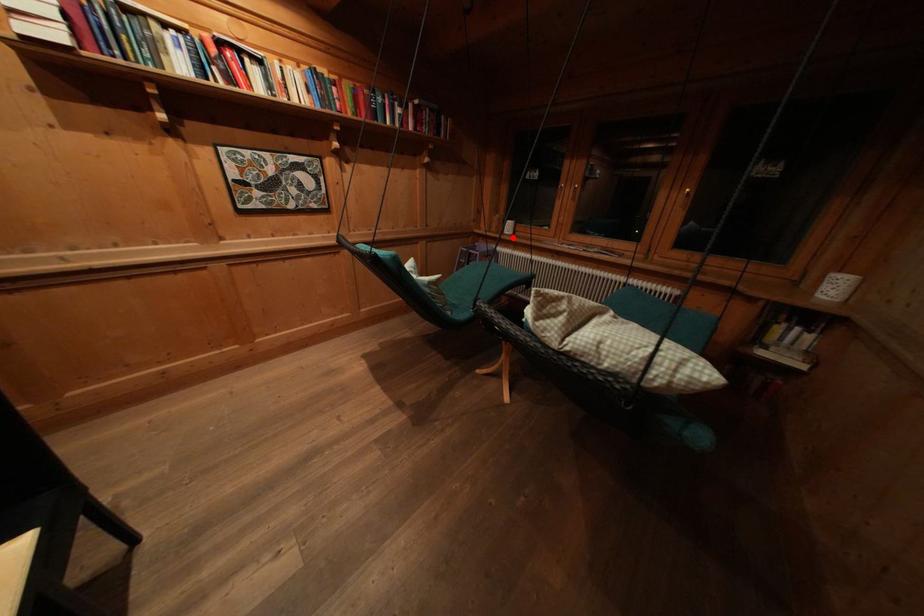
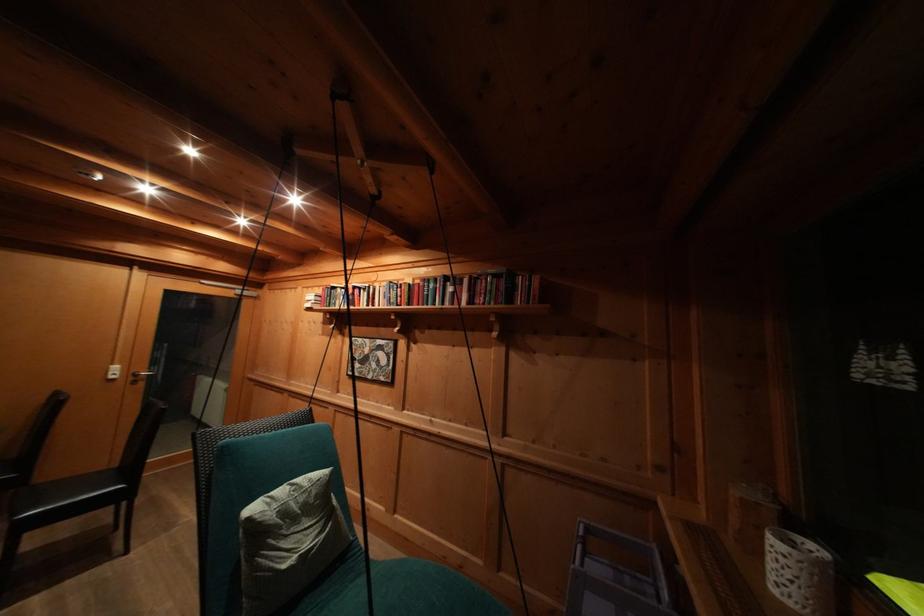
Question: I am providing you with two images of the same scene from different viewpoints. Given a red point in image1, look at the same physical point in image2. Is it:

Choices:
 (A) Closer to the viewpoint
 (B) Farther from the viewpoint

Answer: (B)